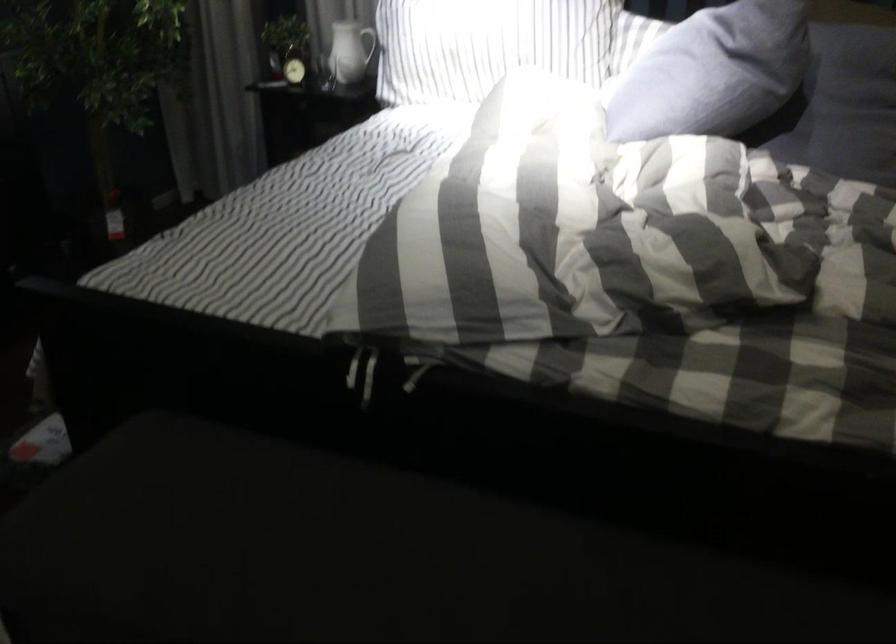
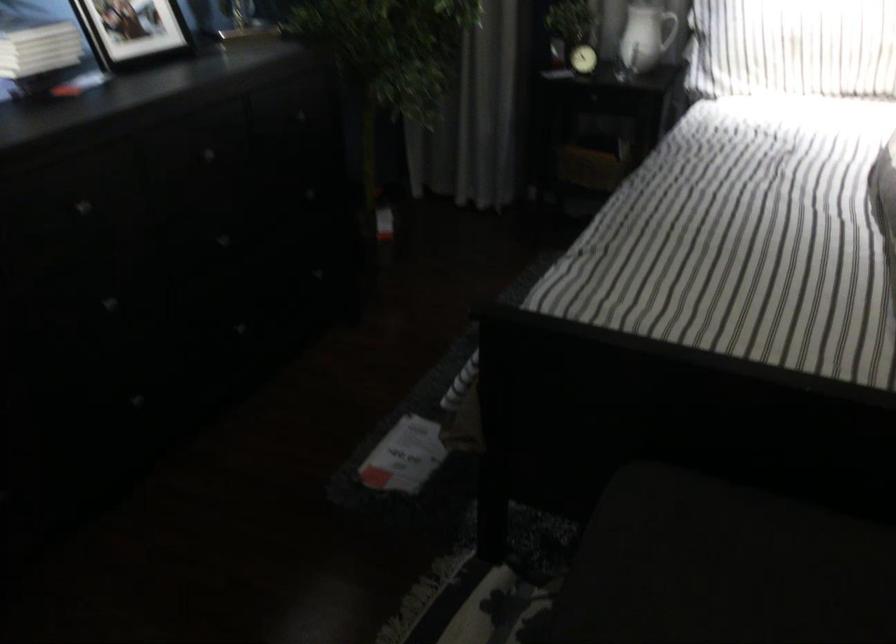
Question: Which direction would the cameraman need to move to produce the second image? Reply with the corresponding letter.

Choices:
 (A) Left
 (B) Right
 (C) Forward
 (D) Backward

Answer: (A)